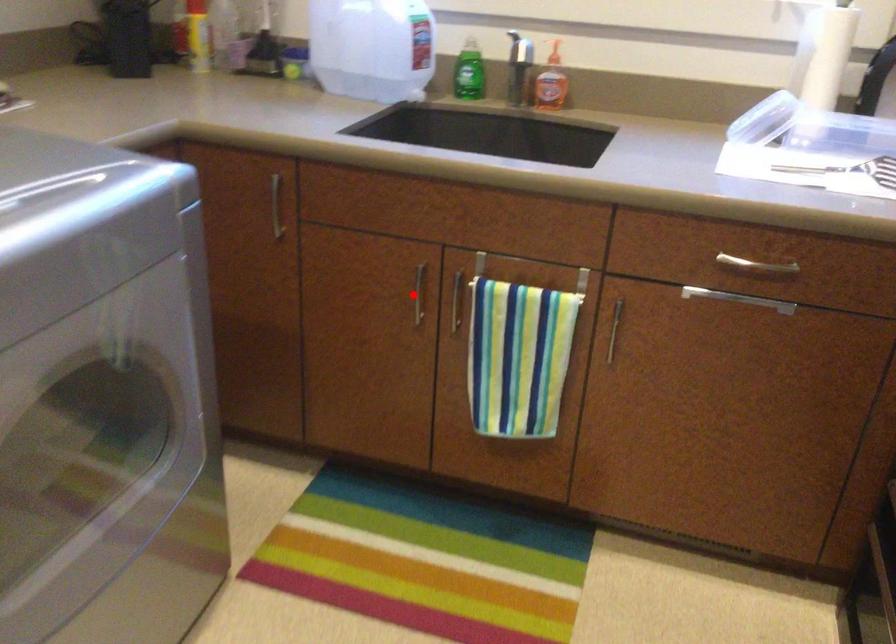
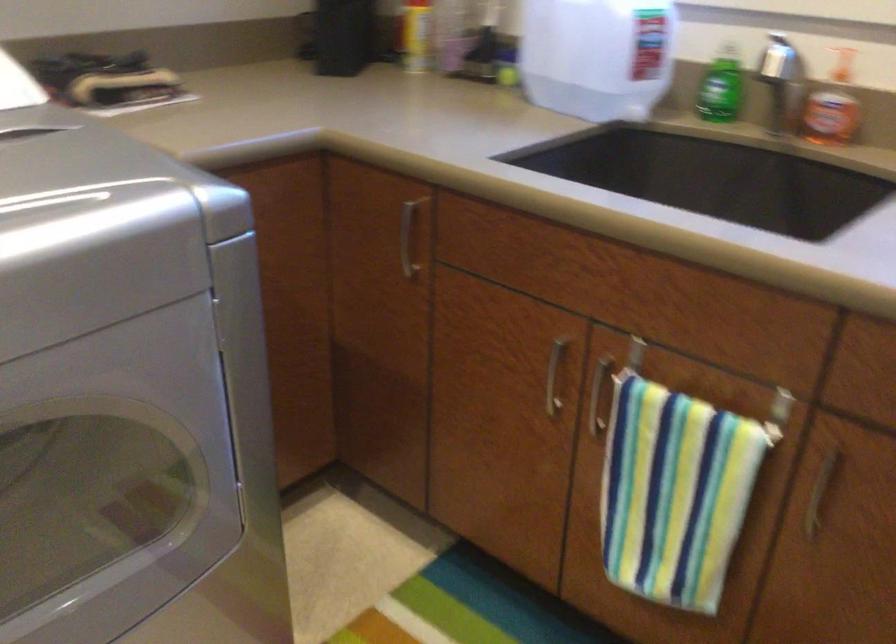
The point at the highlighted location is marked in the first image. Where is the corresponding point in the second image?

(554, 375)